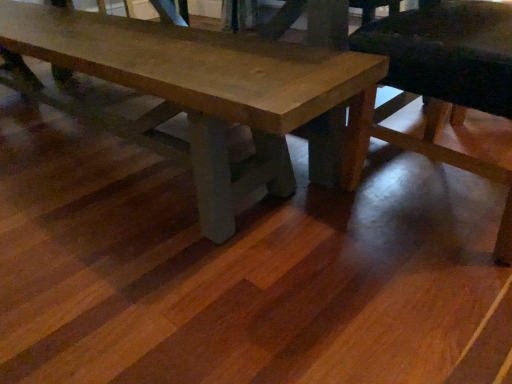
What do you see at coordinates (208, 93) in the screenshot?
I see `wooden table at center` at bounding box center [208, 93].

Locate an element on the screen. The height and width of the screenshot is (384, 512). wooden table at center is located at coordinates (208, 93).

The image size is (512, 384). I want to click on wooden chair at lower right, so click(x=450, y=79).

What do you see at coordinates (450, 79) in the screenshot?
I see `wooden chair at lower right` at bounding box center [450, 79].

You are a GUI agent. You are given a task and a screenshot of the screen. Output one action in this format:
    pyautogui.click(x=<x>, y=<y>)
    Task: Click on the wooden table at center
    Image resolution: width=512 pixels, height=384 pixels.
    Given the screenshot: What is the action you would take?
    pyautogui.click(x=208, y=93)

From the picture: Considering the positions of objects wooden chair at lower right and wooden table at center in the image provided, who is more to the left, wooden chair at lower right or wooden table at center?

Positioned to the left is wooden table at center.

Is wooden chair at lower right closer to the viewer compared to wooden table at center?

Yes.

Does point (509, 215) appear closer or farther from the camera than point (278, 104)?

Point (509, 215).

From the image's perspective, which is above, wooden chair at lower right or wooden table at center?

wooden table at center appears higher in the image.

From a real-world perspective, is wooden chair at lower right physically located above or below wooden table at center?

Clearly, from a real-world perspective, wooden chair at lower right is above wooden table at center.

Considering the relative sizes of wooden chair at lower right and wooden table at center in the image provided, is wooden chair at lower right wider than wooden table at center?

Yes, wooden chair at lower right is wider than wooden table at center.

Which of these two, wooden chair at lower right or wooden table at center, stands taller?

wooden chair at lower right.

Which of these two, wooden chair at lower right or wooden table at center, is bigger?

wooden table at center is bigger.

Is wooden table at center completely or partially inside wooden chair at lower right?

No, wooden table at center is not inside wooden chair at lower right.

Is wooden chair at lower right not near wooden table at center?

No, wooden chair at lower right is in close proximity to wooden table at center.

Is wooden chair at lower right facing towards wooden table at center?

Yes, wooden chair at lower right faces towards wooden table at center.

Where is `table above the wooden chair at lower right (from the image's perspective)`? table above the wooden chair at lower right (from the image's perspective) is located at coordinates (x=208, y=93).

Considering the relative positions of wooden table at center and wooden chair at lower right in the image provided, is wooden table at center to the right of wooden chair at lower right from the viewer's perspective?

No, wooden table at center is not to the right of wooden chair at lower right.

Considering the positions of objects wooden table at center and wooden chair at lower right in the image provided, who is behind, wooden table at center or wooden chair at lower right?

wooden table at center.

Is point (160, 90) positioned in front of point (459, 42)?

No, it is not.

From the image's perspective, who appears lower, wooden table at center or wooden chair at lower right?

wooden chair at lower right, from the image's perspective.

From a real-world perspective, which is physically above, wooden table at center or wooden chair at lower right?

wooden chair at lower right, from a real-world perspective.

Consider the image. Does wooden table at center have a lesser width compared to wooden chair at lower right?

Indeed, wooden table at center has a lesser width compared to wooden chair at lower right.

Considering the sizes of objects wooden table at center and wooden chair at lower right in the image provided, who is taller, wooden table at center or wooden chair at lower right?

Answer: With more height is wooden chair at lower right.

Between wooden table at center and wooden chair at lower right, which one has smaller size?

Smaller between the two is wooden chair at lower right.

Would you say wooden table at center is outside wooden chair at lower right?

Yes, wooden table at center is located beyond the bounds of wooden chair at lower right.

Would you consider wooden table at center to be distant from wooden chair at lower right?

No, wooden table at center is not far away from wooden chair at lower right.

Is wooden table at center positioned with its back to wooden chair at lower right?

wooden table at center does not have its back to wooden chair at lower right.

How different are the orientations of wooden table at center and wooden chair at lower right in degrees?

They differ by 86.4 degrees in their facing directions.

You are a GUI agent. You are given a task and a screenshot of the screen. Output one action in this format:
    pyautogui.click(x=<x>, y=<y>)
    Task: Click on the table located on the left of wooden chair at lower right
    The width and height of the screenshot is (512, 384).
    Given the screenshot: What is the action you would take?
    pyautogui.click(x=208, y=93)

Where is `table on the left of wooden chair at lower right`? Image resolution: width=512 pixels, height=384 pixels. table on the left of wooden chair at lower right is located at coordinates (208, 93).

There is a wooden table at center. What are the coordinates of `chair above it (from a real-world perspective)` in the screenshot? It's located at (450, 79).